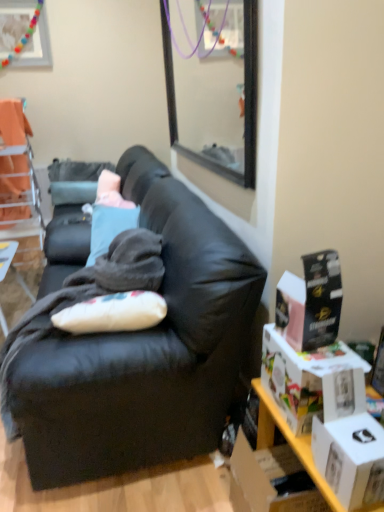
Question: Is white cardboard box at right, which is the second box in bottom-to-top order, outside of black cardboard box at right, placed as the third box when sorted from bottom to top?

Choices:
 (A) no
 (B) yes

Answer: (B)

Question: From the image's perspective, would you say white cardboard box at right, which is the second box in bottom-to-top order, is positioned over black cardboard box at right, placed as the third box when sorted from bottom to top?

Choices:
 (A) yes
 (B) no

Answer: (B)

Question: Considering the relative sizes of white cardboard box at right, which is the second box in bottom-to-top order, and black cardboard box at right, placed as the third box when sorted from bottom to top, in the image provided, is white cardboard box at right, which is the second box in bottom-to-top order, taller than black cardboard box at right, placed as the third box when sorted from bottom to top,?

Choices:
 (A) yes
 (B) no

Answer: (B)

Question: Does white cardboard box at right, positioned as the 2th box in top-to-bottom order, have a lesser height compared to black cardboard box at right, placed as the third box when sorted from bottom to top?

Choices:
 (A) yes
 (B) no

Answer: (A)

Question: Can you confirm if white cardboard box at right, which is the second box in bottom-to-top order, is positioned to the right of black cardboard box at right, marked as the first box in a top-to-bottom arrangement?

Choices:
 (A) no
 (B) yes

Answer: (B)

Question: Is white cardboard box at right, which is the second box in bottom-to-top order, oriented away from black cardboard box at right, placed as the third box when sorted from bottom to top?

Choices:
 (A) yes
 (B) no

Answer: (B)

Question: Is the position of white matte box at lower right, which ranks as the 3th box in top-to-bottom order, less distant than that of wooden picture frame at upper left?

Choices:
 (A) no
 (B) yes

Answer: (B)

Question: From a real-world perspective, is white matte box at lower right, which ranks as the 3th box in top-to-bottom order, positioned over wooden picture frame at upper left based on gravity?

Choices:
 (A) no
 (B) yes

Answer: (A)

Question: Considering the relative sizes of white matte box at lower right, the 1th box positioned from the bottom, and wooden picture frame at upper left in the image provided, is white matte box at lower right, the 1th box positioned from the bottom, bigger than wooden picture frame at upper left?

Choices:
 (A) yes
 (B) no

Answer: (B)

Question: Can you confirm if white matte box at lower right, the 1th box positioned from the bottom, is smaller than wooden picture frame at upper left?

Choices:
 (A) no
 (B) yes

Answer: (B)

Question: Considering the relative positions of white matte box at lower right, which ranks as the 3th box in top-to-bottom order, and wooden picture frame at upper left in the image provided, is white matte box at lower right, which ranks as the 3th box in top-to-bottom order, to the right of wooden picture frame at upper left from the viewer's perspective?

Choices:
 (A) yes
 (B) no

Answer: (A)

Question: Considering the relative sizes of white matte box at lower right, which ranks as the 3th box in top-to-bottom order, and wooden picture frame at upper left in the image provided, is white matte box at lower right, which ranks as the 3th box in top-to-bottom order, wider than wooden picture frame at upper left?

Choices:
 (A) yes
 (B) no

Answer: (A)

Question: Is wooden table at left to the right of orange fabric chair at upper left from the viewer's perspective?

Choices:
 (A) no
 (B) yes

Answer: (B)